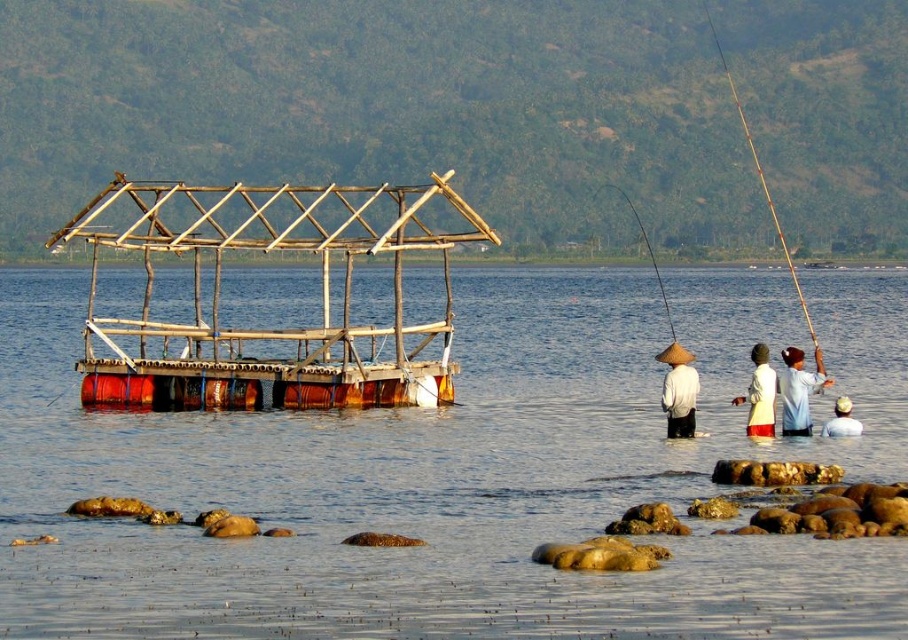
You are a photographer trying to capture a clear shot of both the white woven hat at center and the matte straw hat at center. Since you want to ensure both are in focus, you need to know their vertical positions. Which hat is positioned higher relative to the other?

The white woven hat at center is located above the matte straw hat at center, so it is positioned higher.

Looking at this image, you are standing at the lakeside and want to reach the point marked at coordinates (808, 388). If you can walk at a speed of 1.5 meters per second, how long will it take you to reach that point?

The distance between you and the point marked at coordinates (808, 388) is 39.18 meters. At a walking speed of 1.5 meters per second, it will take approximately 26.12 seconds to reach the point.